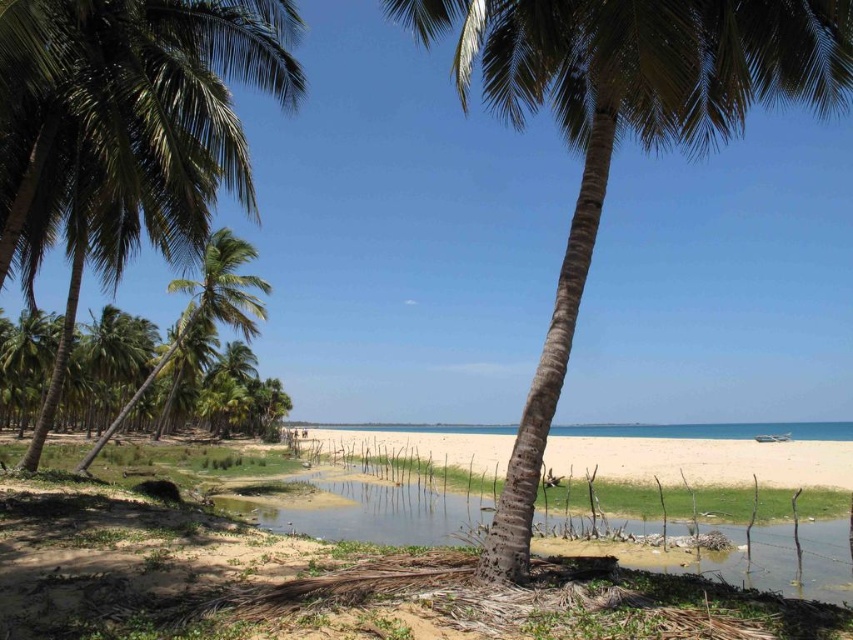
Question: Which point is farther to the camera?

Choices:
 (A) green mossy water at center
 (B) green leafy coconut tree at left
 (C) white sandy beach at center
 (D) green leafy palm tree at center

Answer: (C)

Question: Which point is closer to the camera?

Choices:
 (A) (793, 468)
 (B) (834, 524)

Answer: (B)

Question: Which point appears farthest from the camera in this image?

Choices:
 (A) (67, 336)
 (B) (635, 445)
 (C) (662, 12)

Answer: (B)

Question: Is green leafy coconut tree at left positioned before green leafy palm tree at center?

Choices:
 (A) no
 (B) yes

Answer: (A)

Question: Can you confirm if green leafy coconut tree at left is smaller than green leafy palm tree at center?

Choices:
 (A) yes
 (B) no

Answer: (B)

Question: Is the position of green leafy coconut tree at left less distant than that of white sandy beach at center?

Choices:
 (A) yes
 (B) no

Answer: (A)